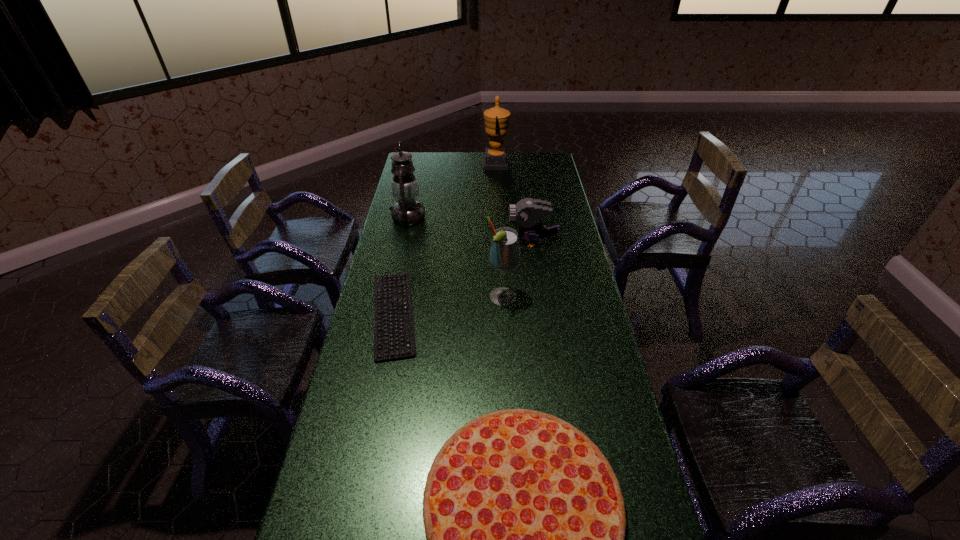
Identify the location of award. The width and height of the screenshot is (960, 540). (496, 119).

Find the location of a particular element. Image resolution: width=960 pixels, height=540 pixels. the fifth nearest object is located at coordinates (407, 211).

In order to click on alcohol in this screenshot , I will do `click(504, 255)`.

Locate an element on the screen. The width and height of the screenshot is (960, 540). the fourth nearest object is located at coordinates (527, 212).

I want to click on bird, so click(527, 212).

Where is `the shortest object`? This screenshot has width=960, height=540. the shortest object is located at coordinates (382, 306).

What are the coordinates of `free spot located at the front of the award with handles` in the screenshot? It's located at (416, 164).

At what (x,y) coordinates should I click in order to perform the action: click on vacant space positioned at the front of the award with handles. Please return your answer as a coordinate pair (x, y). This screenshot has width=960, height=540. Looking at the image, I should click on (445, 164).

Where is `free space located 0.260m at the front of the award with handles`? The width and height of the screenshot is (960, 540). free space located 0.260m at the front of the award with handles is located at coordinates (435, 164).

Find the location of a particular element. vacant area situated on the back of the oil lamp is located at coordinates (417, 180).